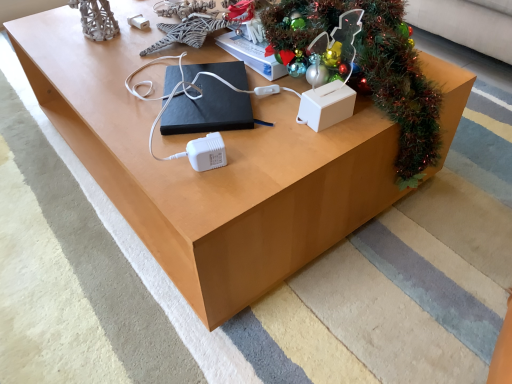
The image size is (512, 384). Describe the element at coordinates (326, 105) in the screenshot. I see `white plastic tissue box at center-right` at that location.

What is the approximate width of black matte book at center?

8.10 inches.

What is the approximate height of green shiny garland at upper right?

green shiny garland at upper right is 17.04 inches tall.

Image resolution: width=512 pixels, height=384 pixels. Find the location of `green shiny garland at upper right`. green shiny garland at upper right is located at coordinates (375, 70).

You are a GUI agent. You are given a task and a screenshot of the screen. Output one action in this format:
    pyautogui.click(x=<x>, y=<y>)
    Task: Click on the white plastic tissue box at center-right
    This screenshot has width=512, height=384.
    Given the screenshot: What is the action you would take?
    pyautogui.click(x=326, y=105)

Considering the sizes of objects black matte book at center and green shiny garland at upper right in the image provided, who is thinner, black matte book at center or green shiny garland at upper right?

With smaller width is black matte book at center.

Looking at this image, is black matte book at center positioned before green shiny garland at upper right?

No, it is not.

Locate an element on the screen. The height and width of the screenshot is (384, 512). christmas tree that is under the black matte book at center (from a real-world perspective) is located at coordinates (375, 70).

From a real-world perspective, does black matte book at center stand above green shiny garland at upper right?

Correct, in the physical world, black matte book at center is higher than green shiny garland at upper right.

Where is `box that appears on the right of black matte book at center`? Image resolution: width=512 pixels, height=384 pixels. box that appears on the right of black matte book at center is located at coordinates (326, 105).

Is black matte book at center at the right side of white plastic tissue box at center-right?

In fact, black matte book at center is to the left of white plastic tissue box at center-right.

From a real-world perspective, which object stands above the other?

white plastic tissue box at center-right, from a real-world perspective.

Considering the sizes of black matte book at center and white plastic tissue box at center-right in the image, is black matte book at center bigger or smaller than white plastic tissue box at center-right?

black matte book at center is bigger than white plastic tissue box at center-right.

Choose the correct answer: Is white plastic tissue box at center-right inside black matte book at center or outside it?

white plastic tissue box at center-right is not inside black matte book at center, it's outside.

Where is `box that appears below the black matte book at center (from the image's perspective)`? box that appears below the black matte book at center (from the image's perspective) is located at coordinates pos(326,105).

Can you tell me how much white plastic tissue box at center-right and black matte book at center differ in facing direction?

They differ by 116 degrees in their facing directions.

Does white plastic tissue box at center-right touch black matte book at center?

No, white plastic tissue box at center-right is not with black matte book at center.

How different are the orientations of white plastic tissue box at center-right and green shiny garland at upper right in degrees?

white plastic tissue box at center-right and green shiny garland at upper right are facing 82.6 degrees away from each other.

Could you tell me if white plastic tissue box at center-right is turned towards green shiny garland at upper right?

Yes, white plastic tissue box at center-right is aimed at green shiny garland at upper right.

Find the location of a particular element. The image size is (512, 384). box above the green shiny garland at upper right (from a real-world perspective) is located at coordinates (326, 105).

Is white plastic tissue box at center-right closer to camera compared to green shiny garland at upper right?

No, white plastic tissue box at center-right is further to the viewer.

From a real-world perspective, who is located higher, green shiny garland at upper right or black matte book at center?

In real-world perspective, black matte book at center is above.

From the image's perspective, which one is positioned higher, green shiny garland at upper right or black matte book at center?

green shiny garland at upper right appears higher in the image.

Considering their positions, is green shiny garland at upper right located in front of or behind black matte book at center?

In the image, green shiny garland at upper right appears in front of black matte book at center.

What's the angular difference between green shiny garland at upper right and white plastic tissue box at center-right's facing directions?

The angular difference between green shiny garland at upper right and white plastic tissue box at center-right is 82.6 degrees.

Between green shiny garland at upper right and white plastic tissue box at center-right, which one has larger size?

green shiny garland at upper right.

Would you consider green shiny garland at upper right to be distant from white plastic tissue box at center-right?

No, green shiny garland at upper right is in close proximity to white plastic tissue box at center-right.

Is green shiny garland at upper right to the left or to the right of white plastic tissue box at center-right in the image?

green shiny garland at upper right is positioned on white plastic tissue box at center-right's right side.

The height and width of the screenshot is (384, 512). In the image, there is a black matte book at center. What are the coordinates of `christmas tree below it (from a real-world perspective)` in the screenshot? It's located at click(x=375, y=70).

Identify the location of box below the black matte book at center (from the image's perspective). (326, 105).

Which object lies further to the anchor point green shiny garland at upper right, black matte book at center or white plastic tissue box at center-right?

The object further to green shiny garland at upper right is black matte book at center.

Consider the image. Looking at the image, which one is located closer to white plastic tissue box at center-right, black matte book at center or green shiny garland at upper right?

green shiny garland at upper right.

Estimate the real-world distances between objects in this image. Which object is further from white plastic tissue box at center-right, green shiny garland at upper right or black matte book at center?

Among the two, black matte book at center is located further to white plastic tissue box at center-right.

Based on their spatial positions, is green shiny garland at upper right or white plastic tissue box at center-right further from black matte book at center?

The object further to black matte book at center is green shiny garland at upper right.

From the image, which object appears to be farther from black matte book at center, white plastic tissue box at center-right or green shiny garland at upper right?

The object further to black matte book at center is green shiny garland at upper right.

Based on their spatial positions, is white plastic tissue box at center-right or black matte book at center further from green shiny garland at upper right?

The object further to green shiny garland at upper right is black matte book at center.

Find the location of a particular element. This screenshot has width=512, height=384. box between black matte book at center and green shiny garland at upper right in the horizontal direction is located at coordinates (326, 105).